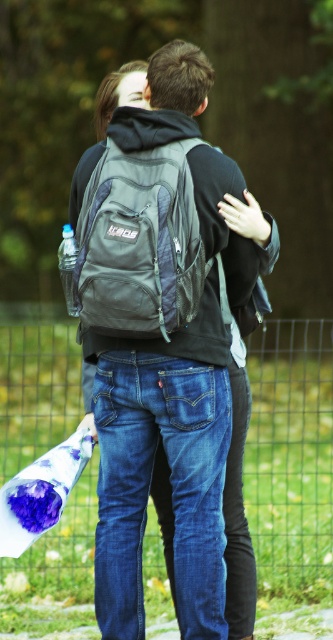
Is matte gray backpack at center positioned behind wire mesh fence at center?

No, matte gray backpack at center is in front of wire mesh fence at center.

Which is more to the left, matte gray backpack at center or wire mesh fence at center?

matte gray backpack at center

The width and height of the screenshot is (333, 640). What do you see at coordinates (160, 337) in the screenshot? I see `matte gray backpack at center` at bounding box center [160, 337].

Locate an element on the screen. The image size is (333, 640). matte gray backpack at center is located at coordinates (160, 337).

Does matte gray backpack at center have a greater height compared to gray fabric backpack at center?

Indeed, matte gray backpack at center has a greater height compared to gray fabric backpack at center.

Describe the element at coordinates (160, 337) in the screenshot. The width and height of the screenshot is (333, 640). I see `matte gray backpack at center` at that location.

Find the location of a particular element. This screenshot has height=640, width=333. matte gray backpack at center is located at coordinates (160, 337).

Locate an element on the screen. Image resolution: width=333 pixels, height=640 pixels. matte gray backpack at center is located at coordinates (160, 337).

Is wire mesh fence at center shorter than gray fabric backpack at center?

No.

Is wire mesh fence at center smaller than gray fabric backpack at center?

No.

Which is behind, point (0, 413) or point (127, 266)?

Positioned behind is point (0, 413).

I want to click on wire mesh fence at center, so click(290, 456).